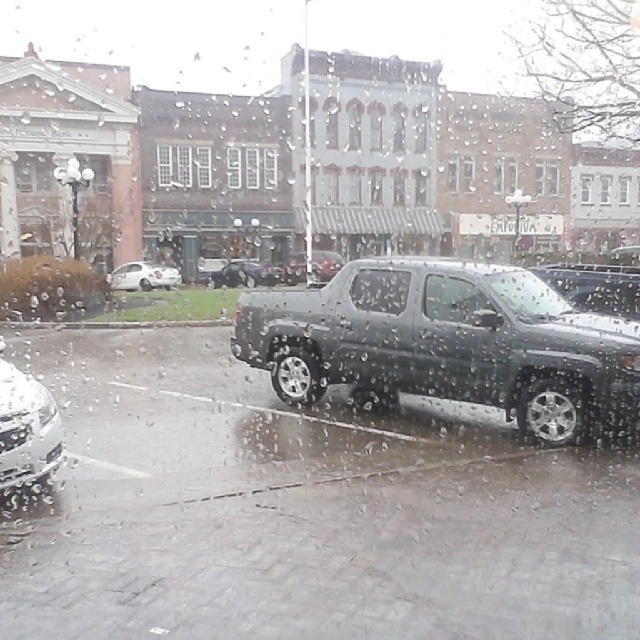
From the picture: Can you confirm if shiny silver sedan at lower left is shorter than white glossy sedan at left?

Yes.

Is shiny silver sedan at lower left positioned before white glossy sedan at left?

That is True.

Consider the image. Who is more distant from viewer, (38, 468) or (131, 268)?

The point (131, 268) is behind.

This screenshot has width=640, height=640. In order to click on shiny silver sedan at lower left in this screenshot , I will do `click(26, 429)`.

Which is above, white glossy sedan at left or metallic silver truck at center?

metallic silver truck at center is above.

Is white glossy sedan at left thinner than metallic silver truck at center?

In fact, white glossy sedan at left might be wider than metallic silver truck at center.

In the scene shown: Who is more distant from viewer, (112,278) or (330,259)?

The point (330,259) is behind.

Locate an element on the screen. The width and height of the screenshot is (640, 640). white glossy sedan at left is located at coordinates (141, 276).

Who is lower down, white glossy sedan at left or metallic gray truck at center?

white glossy sedan at left is below.

Does white glossy sedan at left appear on the left side of metallic gray truck at center?

Correct, you'll find white glossy sedan at left to the left of metallic gray truck at center.

Which is in front, point (138, 282) or point (216, 285)?

Point (138, 282) is in front.

The height and width of the screenshot is (640, 640). Find the location of `white glossy sedan at left`. white glossy sedan at left is located at coordinates (141, 276).